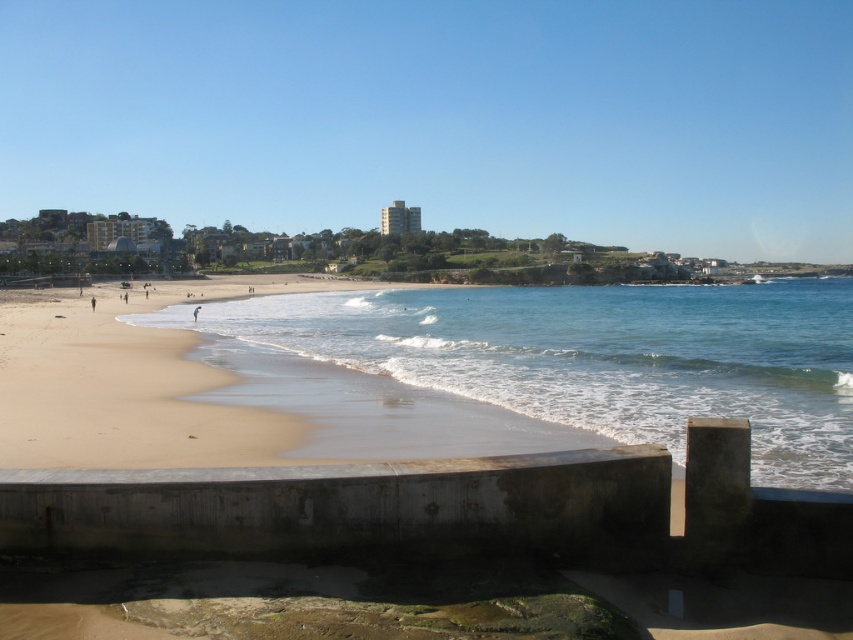
Question: Which object is positioned closest to the light brown sand at lower left?

Choices:
 (A) skinny person at beach center
 (B) clear blue water at beach left

Answer: (A)

Question: Is the position of clear blue water at beach left less distant than that of light brown sand at lower left?

Choices:
 (A) no
 (B) yes

Answer: (B)

Question: Which point is closer to the camera?

Choices:
 (A) (494, 342)
 (B) (3, 408)

Answer: (B)

Question: Which object is positioned closest to the light brown sand at lower left?

Choices:
 (A) skinny person at beach center
 (B) clear blue water at beach left

Answer: (A)

Question: Does clear blue water at beach left have a greater width compared to skinny person at beach center?

Choices:
 (A) yes
 (B) no

Answer: (A)

Question: Does clear blue water at beach left appear on the right side of light brown sand at lower left?

Choices:
 (A) no
 (B) yes

Answer: (B)